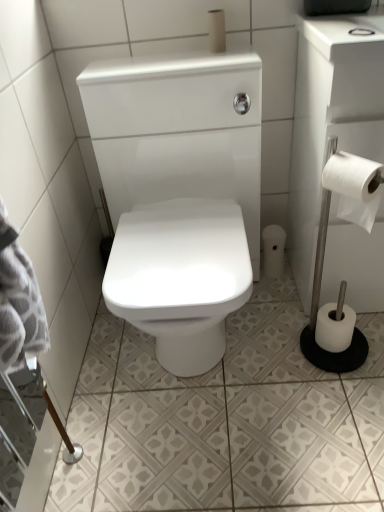
Locate an element on the screen. This screenshot has width=384, height=512. vacant space that's between white paper roll at lower right, the 3th toilet paper in the right-to-left sequence, and white matte toilet paper at lower right, the first toilet paper from the right is located at coordinates (290, 298).